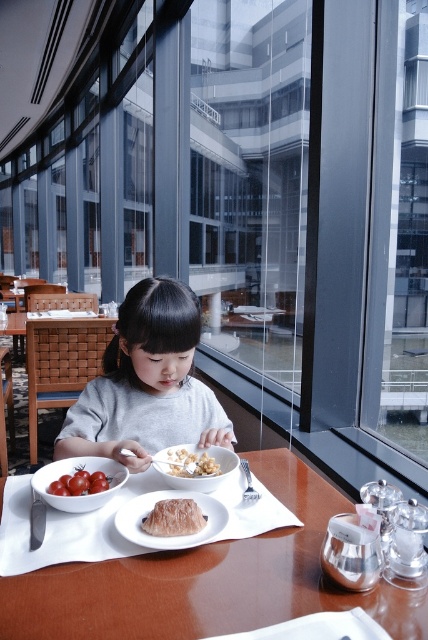
Question: Which object appears farthest from the camera in this image?

Choices:
 (A) gray matte shirt at center
 (B) translucent gelatinous food at center
 (C) white crumbly bread at center

Answer: (C)

Question: Is white glossy plate at center above translucent gelatinous food at center?

Choices:
 (A) yes
 (B) no

Answer: (B)

Question: Which is farther from the white glossy plate at center?

Choices:
 (A) wooden table at center
 (B) gray matte shirt at center
 (C) translucent gelatinous food at center

Answer: (B)

Question: Among these objects, which one is nearest to the camera?

Choices:
 (A) translucent gelatinous food at center
 (B) white glossy plate at center
 (C) gray matte shirt at center

Answer: (B)

Question: From the image, what is the correct spatial relationship of white glossy plate at center in relation to white crumbly bread at center?

Choices:
 (A) left
 (B) right

Answer: (A)

Question: Is gray matte shirt at center thinner than white crumbly bread at center?

Choices:
 (A) no
 (B) yes

Answer: (A)